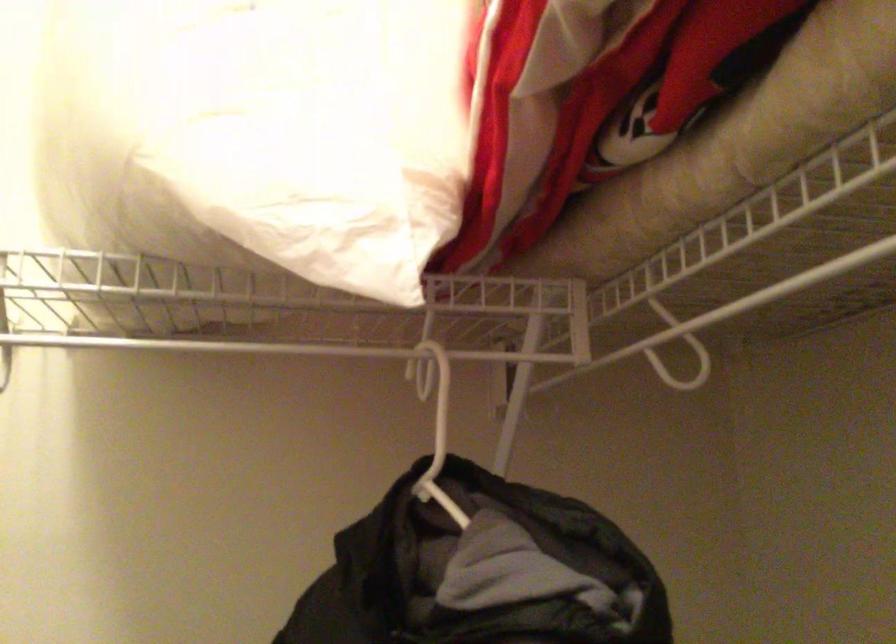
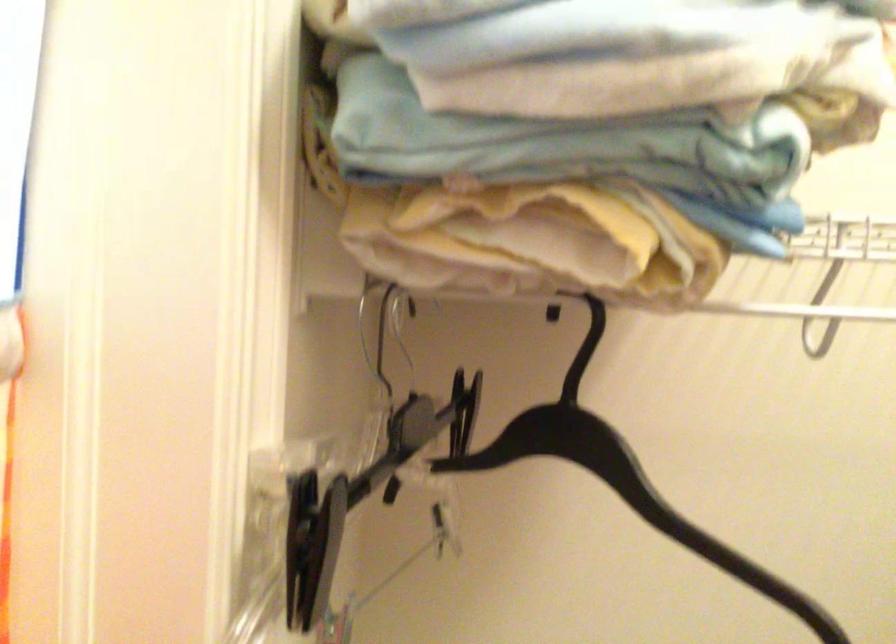
The images are taken continuously from a first-person perspective. In which direction is your viewpoint rotating?

The rotation direction of the camera is left-down.